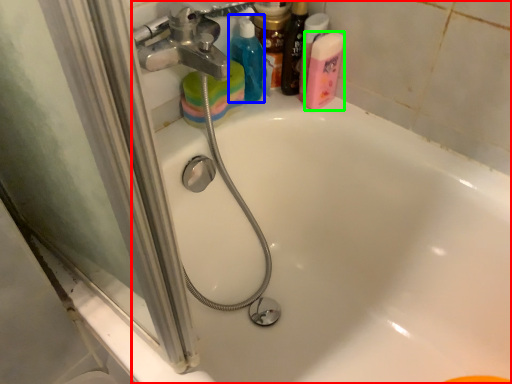
Question: Which object is the farthest from bathtub (highlighted by a red box)? Choose among these: cleaning product (highlighted by a blue box) or cleaning product (highlighted by a green box).

Choices:
 (A) cleaning product
 (B) cleaning product

Answer: (A)